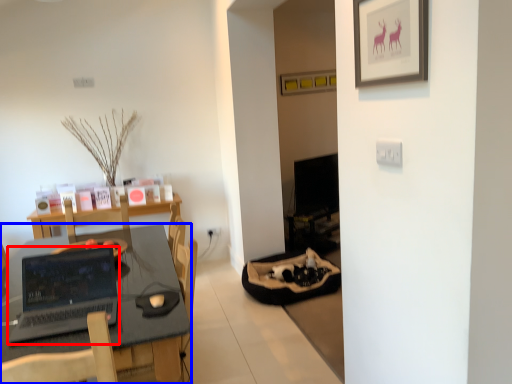
Question: Which point is further to the camera, laptop (highlighted by a red box) or desk (highlighted by a blue box)?

Choices:
 (A) laptop
 (B) desk

Answer: (A)